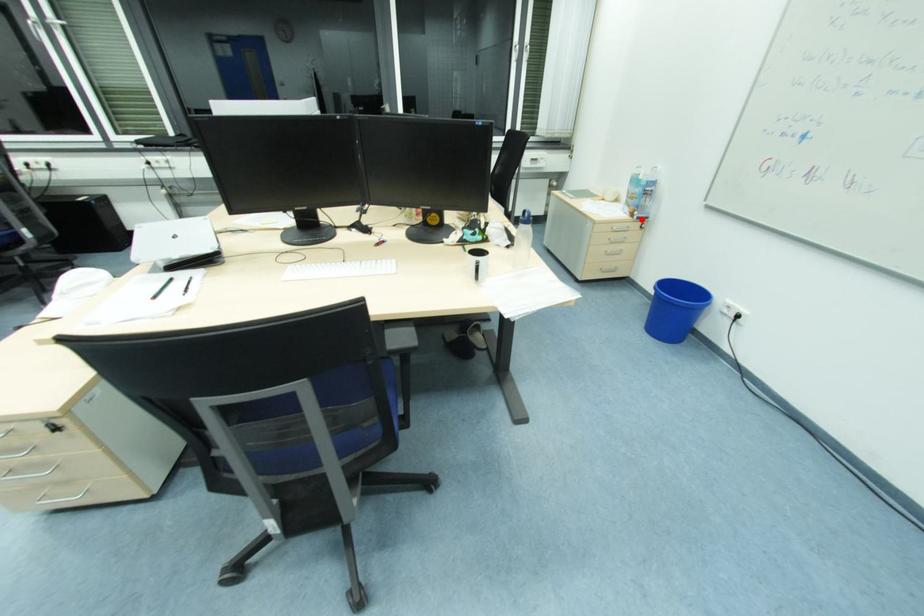
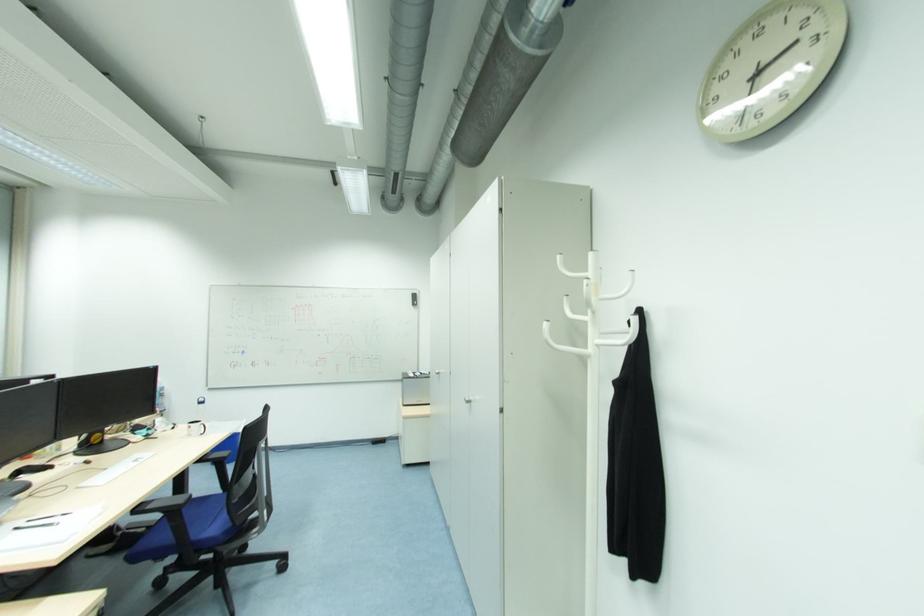
Question: I am providing you with two images of the same scene from different viewpoints. A red point is shown in image1. For the corresponding object point in image2, is it positioned nearer or farther from the camera?

Choices:
 (A) Nearer
 (B) Farther

Answer: (B)